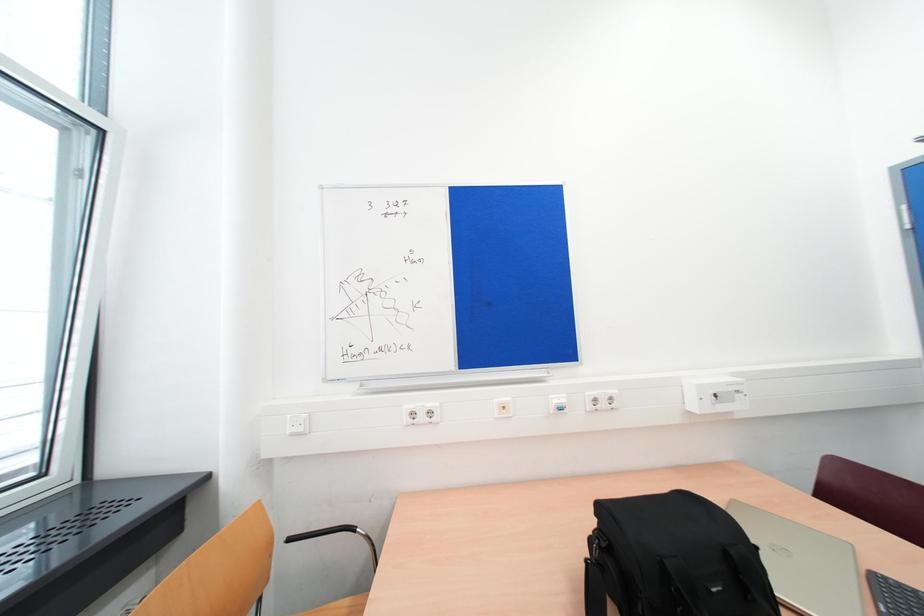
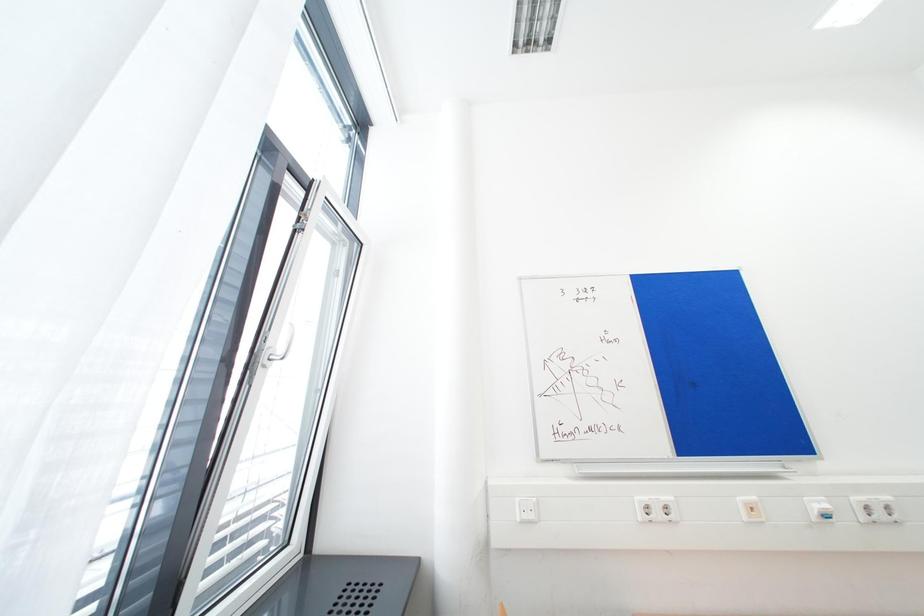
Question: Based on the continuous images, in which direction is the camera rotating? Reply with the corresponding letter.

Choices:
 (A) Left
 (B) Right
 (C) Up
 (D) Down

Answer: (C)